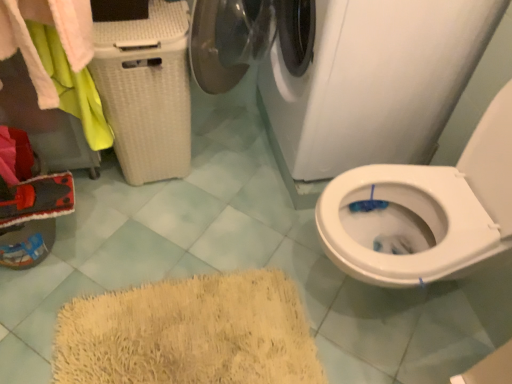
Question: Looking at their shapes, would you say white glossy washing machine at upper center is wider or thinner than white wicker laundry basket at left?

Choices:
 (A) thin
 (B) wide

Answer: (B)

Question: Looking at the image, does white glossy washing machine at upper center seem bigger or smaller compared to white wicker laundry basket at left?

Choices:
 (A) small
 (B) big

Answer: (B)

Question: Estimate the real-world distances between objects in this image. Which object is farther from the white wicker laundry basket at left?

Choices:
 (A) white glossy washing machine at upper center
 (B) white wicker laundry basket at left

Answer: (A)

Question: Which is farther from the white wicker laundry basket at left?

Choices:
 (A) white glossy washing machine at upper center
 (B) white wicker laundry basket at left

Answer: (A)